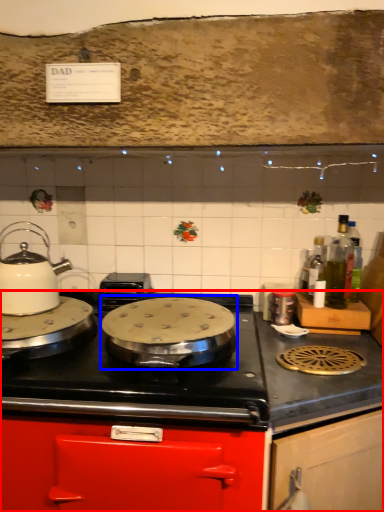
Question: Which of the following is the closest to the observer, cabinetry (highlighted by a red box) or wok (highlighted by a blue box)?

Choices:
 (A) cabinetry
 (B) wok

Answer: (A)